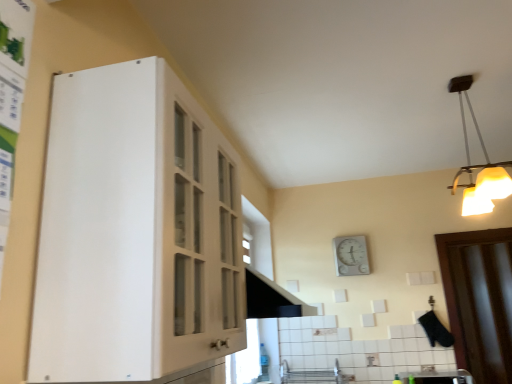
Question: Is white matte cabinet at left touching white glossy sink at lower right?

Choices:
 (A) yes
 (B) no

Answer: (B)

Question: Is white matte cabinet at left not inside white glossy sink at lower right?

Choices:
 (A) yes
 (B) no

Answer: (A)

Question: Is white matte cabinet at left oriented towards white glossy sink at lower right?

Choices:
 (A) no
 (B) yes

Answer: (A)

Question: From the image's perspective, is white matte cabinet at left on top of white glossy sink at lower right?

Choices:
 (A) yes
 (B) no

Answer: (A)

Question: Does white matte cabinet at left have a lesser height compared to white glossy sink at lower right?

Choices:
 (A) no
 (B) yes

Answer: (A)

Question: Is the position of white matte cabinet at left more distant than that of white glossy sink at lower right?

Choices:
 (A) yes
 (B) no

Answer: (B)

Question: From a real-world perspective, is white plastic light fixture at upper right located beneath brown wooden door at right?

Choices:
 (A) no
 (B) yes

Answer: (A)

Question: Is white plastic light fixture at upper right closer to the viewer compared to brown wooden door at right?

Choices:
 (A) yes
 (B) no

Answer: (A)

Question: Considering the relative sizes of white plastic light fixture at upper right and brown wooden door at right in the image provided, is white plastic light fixture at upper right taller than brown wooden door at right?

Choices:
 (A) yes
 (B) no

Answer: (B)

Question: Does white plastic light fixture at upper right touch brown wooden door at right?

Choices:
 (A) yes
 (B) no

Answer: (B)

Question: Is white plastic light fixture at upper right bigger than brown wooden door at right?

Choices:
 (A) no
 (B) yes

Answer: (B)

Question: From the image's perspective, would you say white plastic light fixture at upper right is shown under brown wooden door at right?

Choices:
 (A) yes
 (B) no

Answer: (B)

Question: Is white plastic light fixture at upper right aimed at white matte cabinet at left?

Choices:
 (A) yes
 (B) no

Answer: (B)